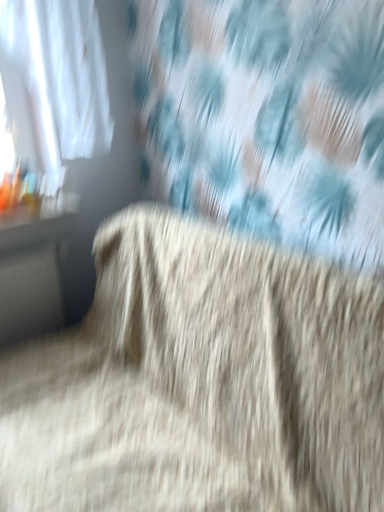
Question: Is matte black table at left not close to fuzzy beige carpet at center?

Choices:
 (A) no
 (B) yes

Answer: (A)

Question: Can you confirm if matte black table at left is taller than fuzzy beige carpet at center?

Choices:
 (A) no
 (B) yes

Answer: (A)

Question: From a real-world perspective, does matte black table at left sit lower than fuzzy beige carpet at center?

Choices:
 (A) no
 (B) yes

Answer: (A)

Question: Can you confirm if matte black table at left is smaller than fuzzy beige carpet at center?

Choices:
 (A) no
 (B) yes

Answer: (B)

Question: Considering the relative positions of matte black table at left and fuzzy beige carpet at center in the image provided, is matte black table at left to the right of fuzzy beige carpet at center from the viewer's perspective?

Choices:
 (A) no
 (B) yes

Answer: (A)

Question: Is matte black table at left to the left of fuzzy beige carpet at center from the viewer's perspective?

Choices:
 (A) yes
 (B) no

Answer: (A)

Question: Is fuzzy beige carpet at center closer to the viewer compared to matte black table at left?

Choices:
 (A) no
 (B) yes

Answer: (B)

Question: Can you confirm if fuzzy beige carpet at center is shorter than matte black table at left?

Choices:
 (A) no
 (B) yes

Answer: (A)

Question: Can you confirm if fuzzy beige carpet at center is taller than matte black table at left?

Choices:
 (A) yes
 (B) no

Answer: (A)

Question: From a real-world perspective, is fuzzy beige carpet at center physically below matte black table at left?

Choices:
 (A) yes
 (B) no

Answer: (A)

Question: Is fuzzy beige carpet at center bigger than matte black table at left?

Choices:
 (A) yes
 (B) no

Answer: (A)

Question: From a real-world perspective, does fuzzy beige carpet at center stand above matte black table at left?

Choices:
 (A) no
 (B) yes

Answer: (A)

Question: Considering the positions of matte black table at left and fuzzy beige carpet at center in the image, is matte black table at left wider or thinner than fuzzy beige carpet at center?

Choices:
 (A) wide
 (B) thin

Answer: (B)